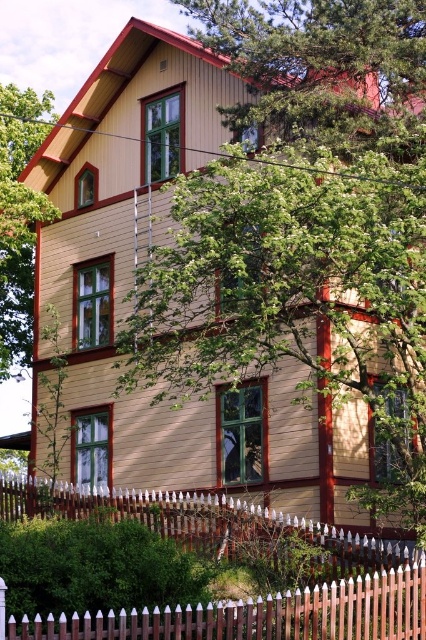
Question: Which point appears farthest from the camera in this image?

Choices:
 (A) (14, 358)
 (B) (103, 632)
 (C) (385, 86)

Answer: (A)

Question: Does green leafy tree at upper center appear under brown wooden fence at lower center?

Choices:
 (A) yes
 (B) no

Answer: (B)

Question: Which object appears farthest from the camera in this image?

Choices:
 (A) green leafy tree at center
 (B) brown wooden fence at lower center

Answer: (A)

Question: Considering the real-world distances, which object is closest to the brown wooden fence at lower center?

Choices:
 (A) green leafy tree at left
 (B) green leafy tree at upper center
 (C) green leafy tree at center

Answer: (C)

Question: Can you confirm if green leafy tree at center is positioned to the left of green leafy tree at left?

Choices:
 (A) yes
 (B) no

Answer: (B)

Question: Can you confirm if green leafy tree at center is positioned to the left of brown wooden fence at lower center?

Choices:
 (A) yes
 (B) no

Answer: (B)